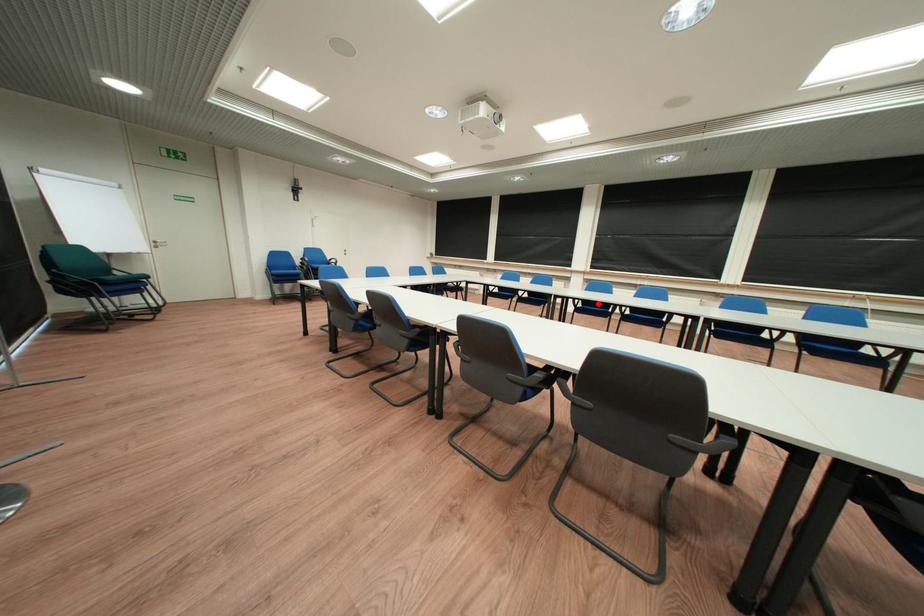
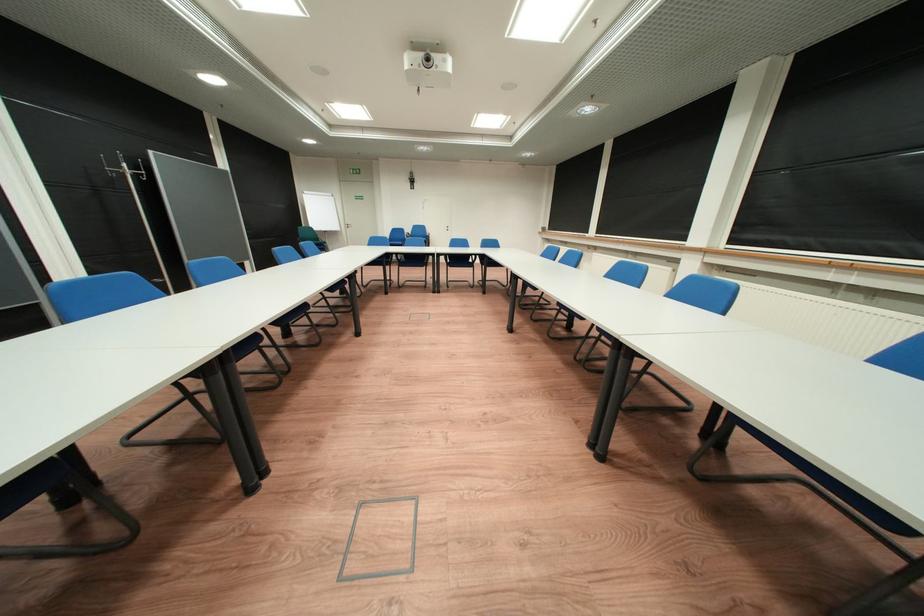
Question: I am providing you with two images of the same scene from different viewpoints. A red point is marked on the first image. Can you still see the location of the red point in image 2?

Choices:
 (A) Yes
 (B) No

Answer: (B)